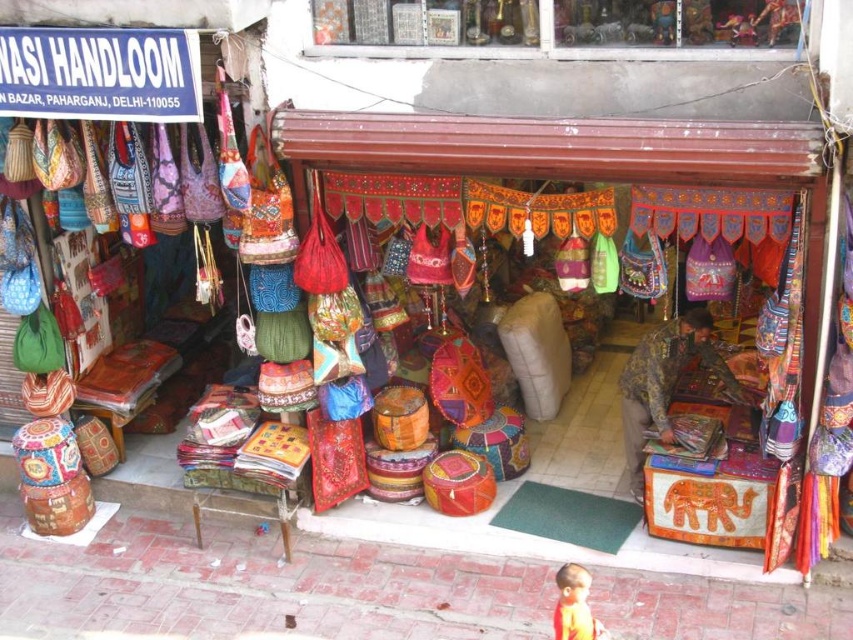
You are standing at the entrance of the shop and want to locate the camouflage fabric boy at center. Based on the coordinates provided, where should you look relative to the entrance?

The camouflage fabric boy at center is located at coordinates point (x=665, y=381), which is towards the lower right side of the shop entrance.

You are a customer looking at the camouflage fabric boy at center and the orange fabric boy at lower right. Which one is more to the right?

The camouflage fabric boy at center is more to the right than the orange fabric boy at lower right.

You are a customer standing at the entrance of the shop and see the camouflage fabric boy at center and the orange fabric boy at lower right. Which one is higher up?

The camouflage fabric boy at center is located above the orange fabric boy at lower right, so it is higher up.